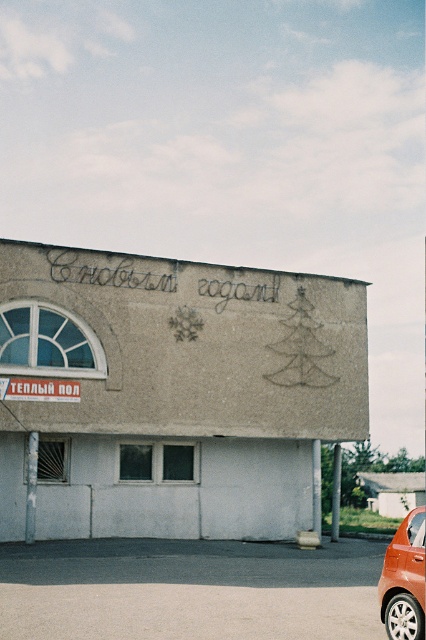
Question: Which object appears farthest from the camera in this image?

Choices:
 (A) white plastic sign at upper left
 (B) orange matte car at lower right

Answer: (A)

Question: Among these objects, which one is farthest from the camera?

Choices:
 (A) white plastic sign at upper left
 (B) orange matte car at lower right

Answer: (A)

Question: Does orange matte car at lower right have a larger size compared to white plastic sign at upper left?

Choices:
 (A) yes
 (B) no

Answer: (A)

Question: Observing the image, what is the correct spatial positioning of orange matte car at lower right in reference to white plastic sign at upper left?

Choices:
 (A) above
 (B) below

Answer: (B)

Question: Does orange matte car at lower right have a larger size compared to white plastic sign at upper left?

Choices:
 (A) no
 (B) yes

Answer: (B)